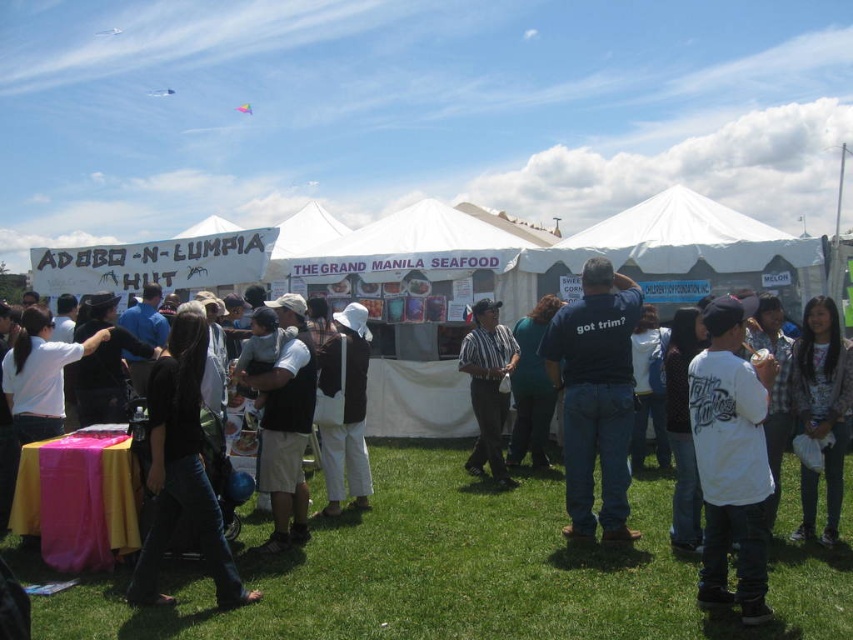
Question: Considering the real-world distances, which object is closest to the green grass at lower center?

Choices:
 (A) striped fabric shirt at center
 (B) black fabric at center

Answer: (B)

Question: Which object is the closest to the teal fabric shirt at center?

Choices:
 (A) green grass at lower center
 (B) black fabric at center
 (C) white cotton hat at center
 (D) white matte shirt at center

Answer: (C)

Question: Does white matte shirt at center have a smaller size compared to black fabric at center?

Choices:
 (A) no
 (B) yes

Answer: (B)

Question: Which object is positioned farthest from the denim jacket at lower right?

Choices:
 (A) striped fabric shirt at center
 (B) green grass at lower center

Answer: (A)

Question: Does striped fabric shirt at center appear under teal fabric shirt at center?

Choices:
 (A) no
 (B) yes

Answer: (B)

Question: Is denim jacket at lower right wider than teal fabric shirt at center?

Choices:
 (A) no
 (B) yes

Answer: (A)